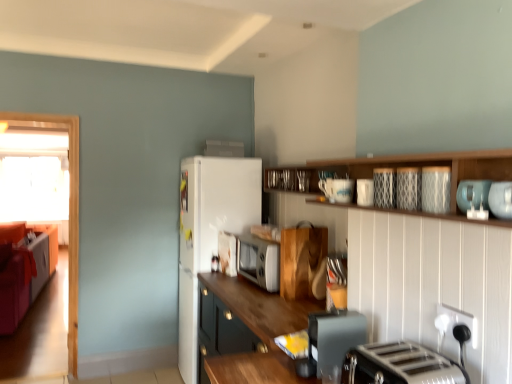
Where is `vacant position to the left of wooden microwave at center, acting as the 6th appliance starting from the top`? This screenshot has height=384, width=512. vacant position to the left of wooden microwave at center, acting as the 6th appliance starting from the top is located at coordinates (226, 282).